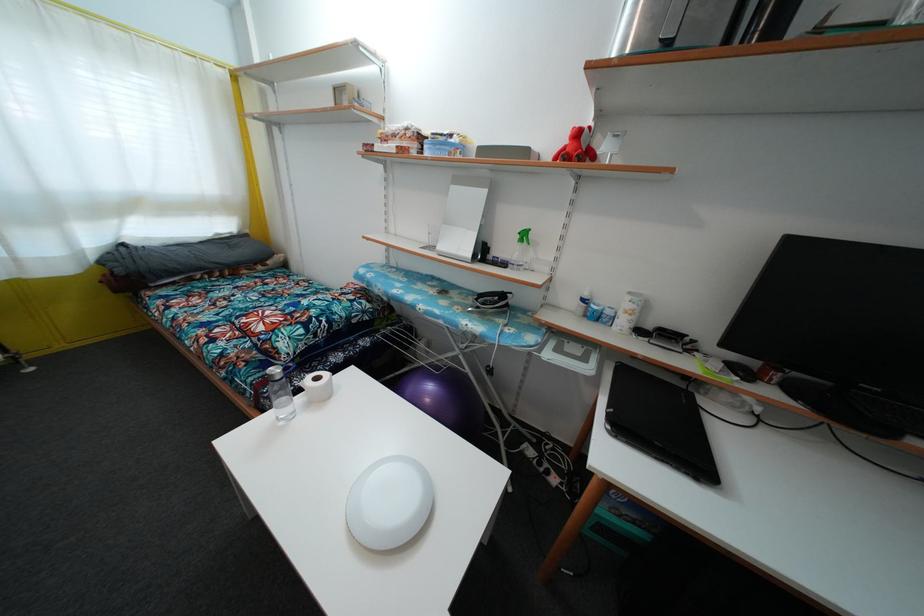
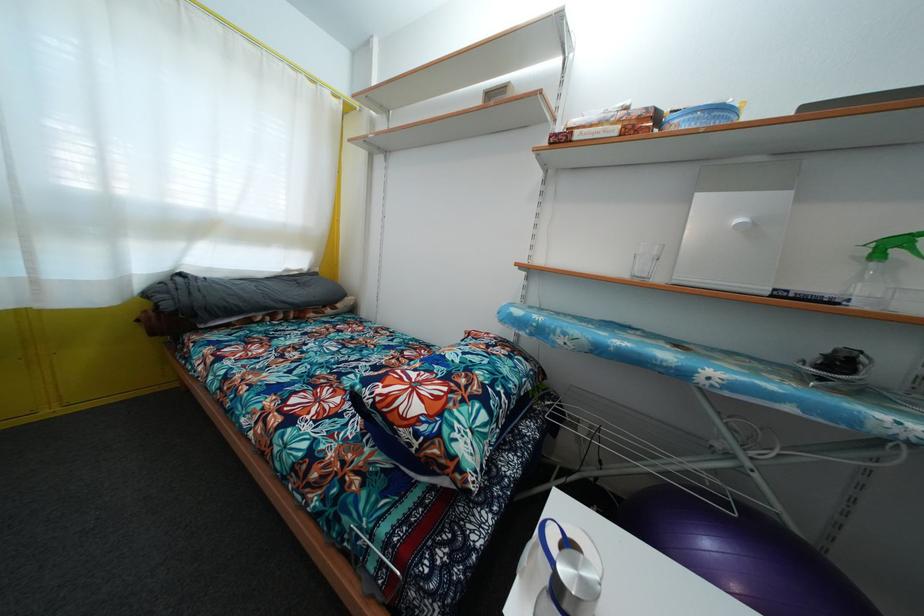
What movement of the cameraman would produce the second image?

The cameraman moved toward left, forward.